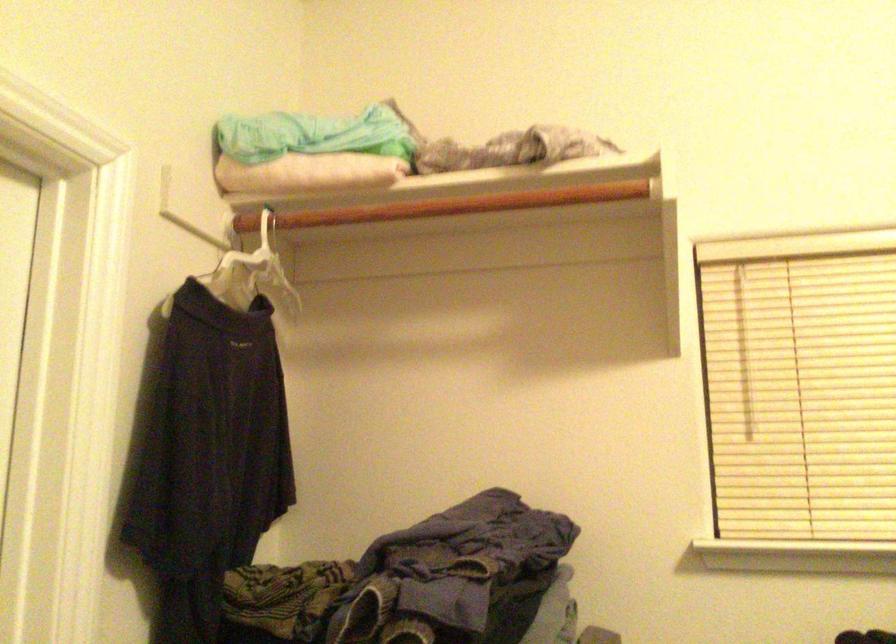
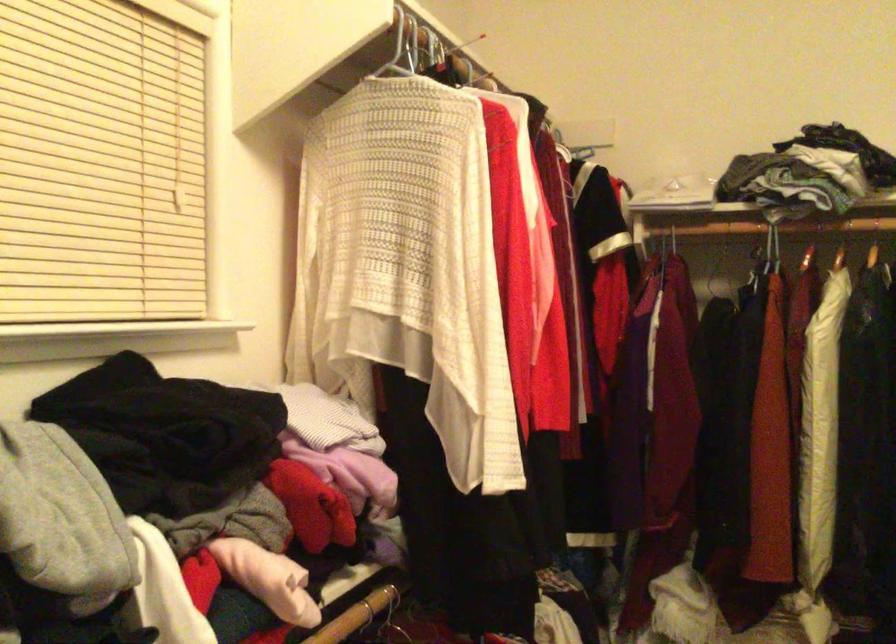
Question: Based on the continuous images, in which direction is the camera rotating? Reply with the corresponding letter.

Choices:
 (A) Left
 (B) Right
 (C) Up
 (D) Down

Answer: (B)